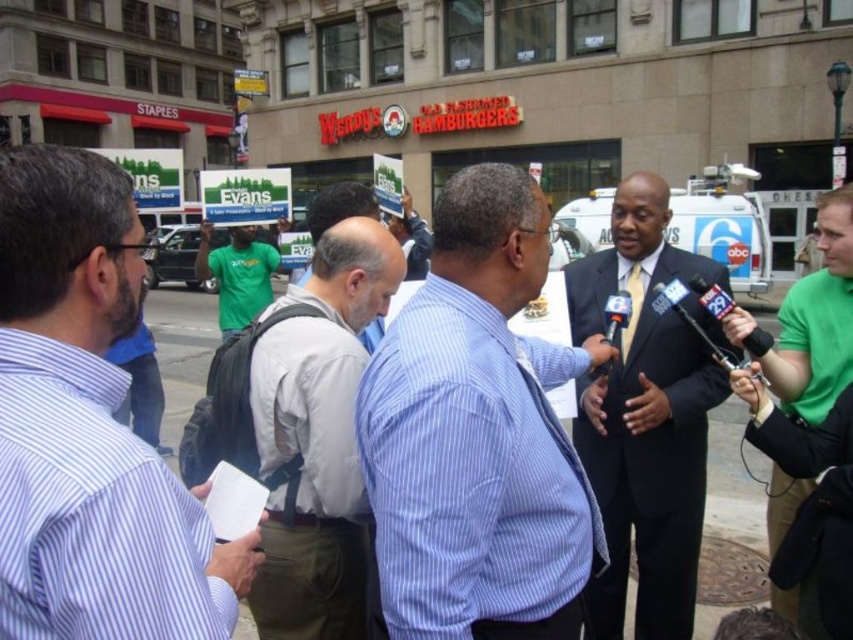
You are standing at the point labeled as point (252, 250) and want to walk towards the reporter holding the microphones. Is the point labeled as point (316, 364) in your path?

Yes, the point labeled as point (316, 364) is in your path because it is in front of point (252, 250).

In the scene shown: You are a photographer at the press conference. You need to capture a photo of both the striped cotton shirt at left and the matte black suit at center. Based on their positions, which one is closer to the left edge of the photo?

The striped cotton shirt at left is positioned to the left of the matte black suit at center, so it is closer to the left edge of the photo.

You are a photographer trying to capture a headshot of both the striped cotton shirt at left and the matte black suit at center. Since you want both subjects to appear in the frame, which subject should you position closer to the camera to ensure their heads are at the same level?

The striped cotton shirt at left is not as tall as the matte black suit at center. To have their heads at the same level in the photo, position the striped cotton shirt at left closer to the camera than the matte black suit at center.